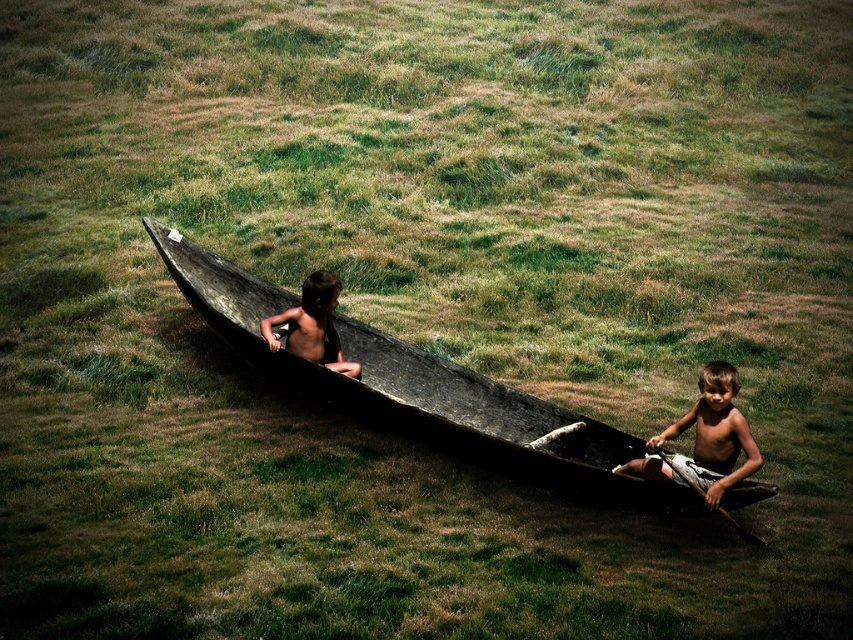
Question: Where is dark wood canoe at center located in relation to shiny brown hair at center in the image?

Choices:
 (A) above
 (B) below

Answer: (B)

Question: Which object is the farthest from the wooden smooth paddle at lower right?

Choices:
 (A) shiny brown hair at center
 (B) dark wood canoe at center
 (C) light brown wooden boat at lower right

Answer: (A)

Question: Is dark wood canoe at center above wooden smooth paddle at lower right?

Choices:
 (A) yes
 (B) no

Answer: (A)

Question: Among these objects, which one is farthest from the camera?

Choices:
 (A) wooden smooth paddle at lower right
 (B) light brown wooden boat at lower right

Answer: (B)

Question: Which object appears farthest from the camera in this image?

Choices:
 (A) wooden smooth paddle at lower right
 (B) dark wood canoe at center
 (C) shiny brown hair at center

Answer: (B)

Question: Does dark wood canoe at center appear on the left side of light brown wooden boat at lower right?

Choices:
 (A) no
 (B) yes

Answer: (B)